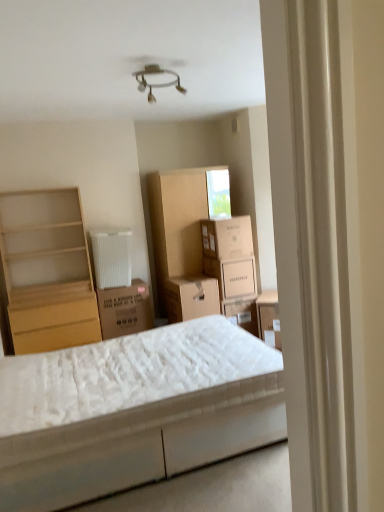
Question: Considering the positions of white cardboard box at center, marked as the 2th cardboard box in a top-to-bottom arrangement, and white quilted mattress at center in the image, is white cardboard box at center, marked as the 2th cardboard box in a top-to-bottom arrangement, taller or shorter than white quilted mattress at center?

Choices:
 (A) tall
 (B) short

Answer: (B)

Question: From the image's perspective, is white cardboard box at center, marked as the 2th cardboard box in a top-to-bottom arrangement, above or below white quilted mattress at center?

Choices:
 (A) above
 (B) below

Answer: (A)

Question: Considering the real-world distances, which object is closest to the matte cardboard storage box at center, which is the first storage box from right to left?

Choices:
 (A) white quilted mattress at center
 (B) cardboard cabinet at center
 (C) brown cardboard box at center, the 2th storage box in the right-to-left sequence
 (D) white cardboard box at center, the 2th cardboard box viewed from the left
 (E) white cardboard box at center, acting as the 3th cardboard box starting from the left

Answer: (E)

Question: Considering the real-world distances, which object is farthest from the brown cardboard box at center, the third cardboard box viewed from the top?

Choices:
 (A) matte cardboard storage box at center, which is the first storage box from right to left
 (B) white cardboard box at center, positioned as the second cardboard box in bottom-to-top order
 (C) brown cardboard box at center, the 1th storage box in the left-to-right sequence
 (D) cardboard cabinet at center
 (E) white quilted mattress at center

Answer: (E)